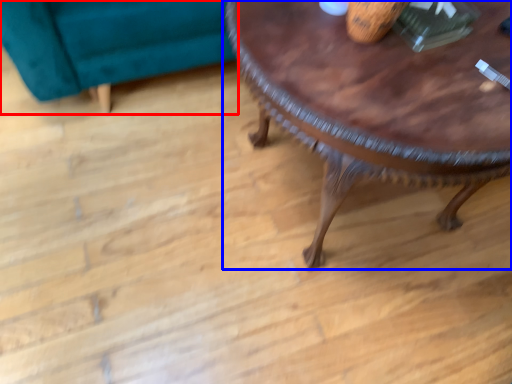
Question: Among these objects, which one is farthest to the camera, swivel chair (highlighted by a red box) or coffee table (highlighted by a blue box)?

Choices:
 (A) swivel chair
 (B) coffee table

Answer: (A)